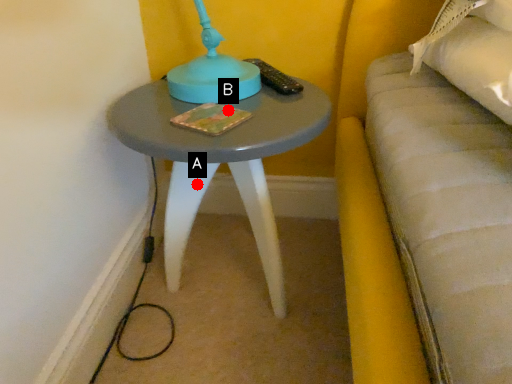
Question: Two points are circled on the image, labeled by A and B beside each circle. Which point is further to the camera?

Choices:
 (A) A is further
 (B) B is further

Answer: (A)